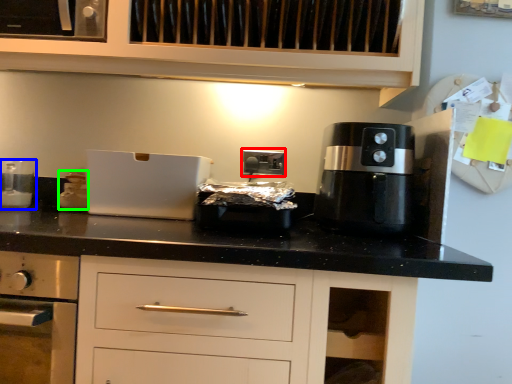
Question: Estimate the real-world distances between objects in this image. Which object is farther from electric outlet (highlighted by a red box), kitchen appliance (highlighted by a blue box) or kitchen appliance (highlighted by a green box)?

Choices:
 (A) kitchen appliance
 (B) kitchen appliance

Answer: (A)